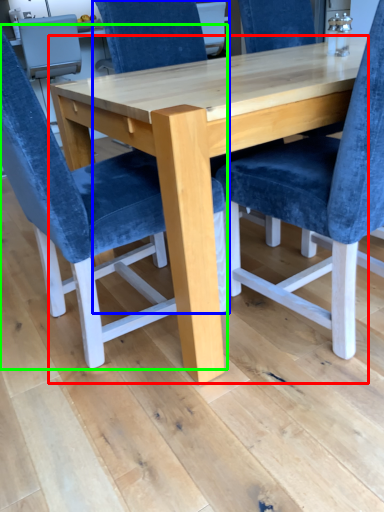
Question: Based on their relative distances, which object is farther from table (highlighted by a red box)? Choose from chair (highlighted by a blue box) and chair (highlighted by a green box).

Choices:
 (A) chair
 (B) chair

Answer: (A)